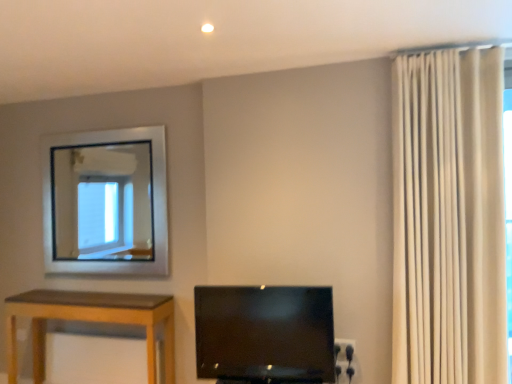
Question: Considering the relative positions of matte black tv at center and white textured curtain at right in the image provided, is matte black tv at center behind white textured curtain at right?

Choices:
 (A) no
 (B) yes

Answer: (B)

Question: From the image's perspective, is matte black tv at center beneath white textured curtain at right?

Choices:
 (A) no
 (B) yes

Answer: (B)

Question: From the image's perspective, is matte black tv at center over white textured curtain at right?

Choices:
 (A) yes
 (B) no

Answer: (B)

Question: From a real-world perspective, is matte black tv at center below white textured curtain at right?

Choices:
 (A) yes
 (B) no

Answer: (A)

Question: From a real-world perspective, is matte black tv at center positioned over white textured curtain at right based on gravity?

Choices:
 (A) no
 (B) yes

Answer: (A)

Question: Is matte black tv at center not inside white textured curtain at right?

Choices:
 (A) no
 (B) yes

Answer: (B)

Question: Is the position of white textured curtain at right more distant than that of matte black tv at center?

Choices:
 (A) no
 (B) yes

Answer: (A)

Question: From the image's perspective, is white textured curtain at right beneath matte black tv at center?

Choices:
 (A) no
 (B) yes

Answer: (A)

Question: Is white textured curtain at right taller than matte black tv at center?

Choices:
 (A) no
 (B) yes

Answer: (B)

Question: Can you confirm if white textured curtain at right is bigger than matte black tv at center?

Choices:
 (A) yes
 (B) no

Answer: (A)

Question: Is the surface of white textured curtain at right in direct contact with matte black tv at center?

Choices:
 (A) yes
 (B) no

Answer: (B)

Question: Is white textured curtain at right closer to the viewer compared to matte black tv at center?

Choices:
 (A) no
 (B) yes

Answer: (B)

Question: In terms of height, does white textured curtain at right look taller or shorter compared to matte black tv at center?

Choices:
 (A) tall
 (B) short

Answer: (A)